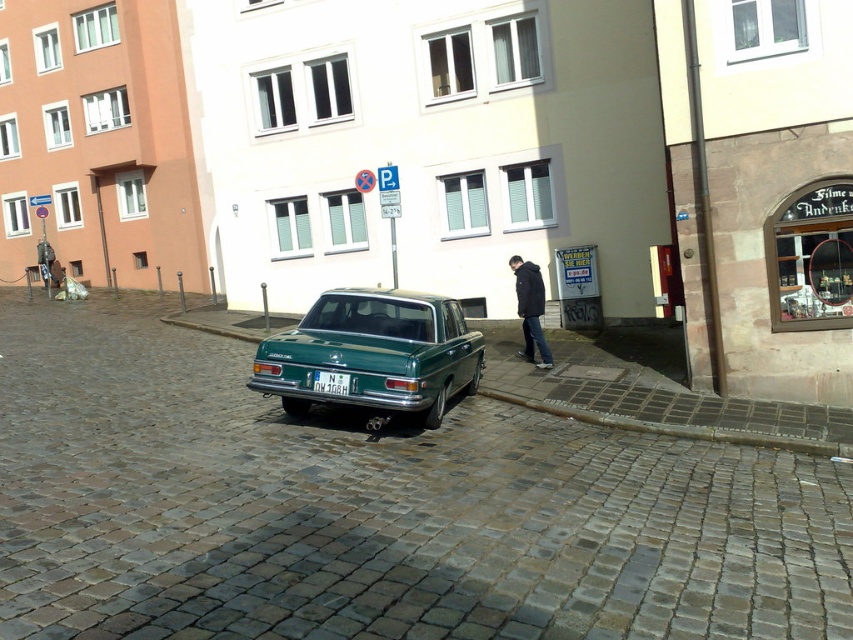
Between green metallic car at center and black matte jacket at center, which one has less height?

Standing shorter between the two is green metallic car at center.

Between green metallic car at center and black matte jacket at center, which one is positioned lower?

Positioned lower is green metallic car at center.

Is point (428, 340) positioned behind point (524, 301)?

That is False.

Image resolution: width=853 pixels, height=640 pixels. I want to click on green metallic car at center, so click(x=374, y=355).

Is green metallic curb at lower center to the right of white plastic license plate at center from the viewer's perspective?

Indeed, green metallic curb at lower center is positioned on the right side of white plastic license plate at center.

Is green metallic curb at lower center smaller than white plastic license plate at center?

No, green metallic curb at lower center is not smaller than white plastic license plate at center.

Who is more forward, (653, 406) or (329, 384)?

Point (329, 384) is more forward.

Image resolution: width=853 pixels, height=640 pixels. Identify the location of green metallic curb at lower center. (669, 408).

Does point (384, 412) come behind point (491, 365)?

No, it is in front of (491, 365).

Can you confirm if green metallic car at center is shorter than green metallic curb at lower center?

In fact, green metallic car at center may be taller than green metallic curb at lower center.

This screenshot has height=640, width=853. Identify the location of green metallic car at center. coord(374,355).